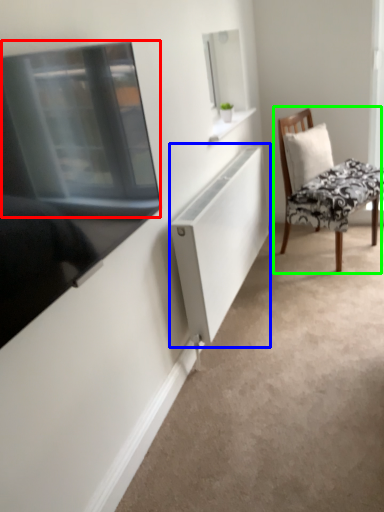
Question: Which object is the farthest from window screen (highlighted by a red box)? Choose among these: cabinet (highlighted by a blue box) or chair (highlighted by a green box).

Choices:
 (A) cabinet
 (B) chair

Answer: (B)